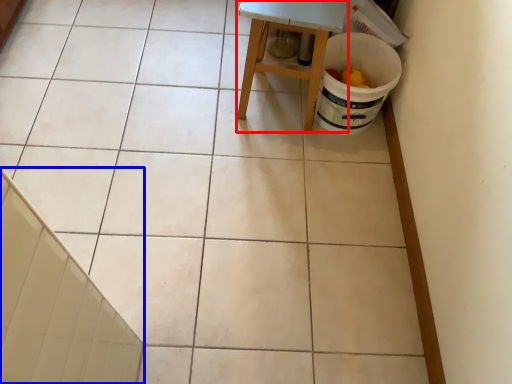
Question: Which point is closer to the camera, furniture (highlighted by a red box) or stair (highlighted by a blue box)?

Choices:
 (A) furniture
 (B) stair

Answer: (B)